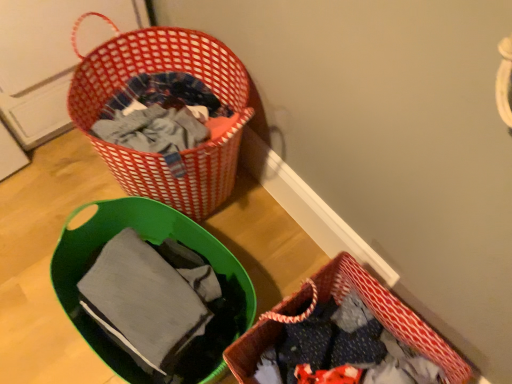
Question: In terms of height, does matte gray fabric at lower left look taller or shorter compared to red woven basket at upper left, placed as the first picnic basket when sorted from left to right?

Choices:
 (A) short
 (B) tall

Answer: (A)

Question: Considering the positions of point (186, 311) and point (117, 89), is point (186, 311) closer or farther from the camera than point (117, 89)?

Choices:
 (A) farther
 (B) closer

Answer: (B)

Question: Which object is positioned closest to the matte gray fabric at lower left?

Choices:
 (A) red woven picnic basket at lower right, arranged as the 2th picnic basket when viewed from the left
 (B) red woven basket at upper left, the first picnic basket when ordered from top to bottom

Answer: (A)

Question: Considering the real-world distances, which object is closest to the red woven basket at upper left, the first picnic basket when ordered from top to bottom?

Choices:
 (A) matte gray fabric at lower left
 (B) red woven picnic basket at lower right, arranged as the 2th picnic basket when viewed from the left

Answer: (A)